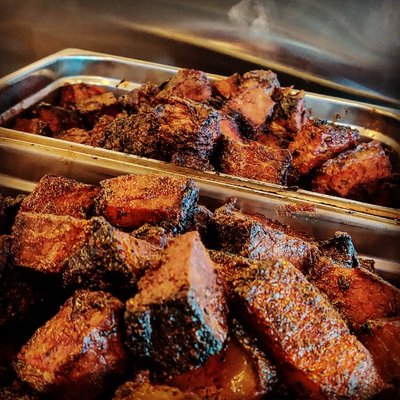
The height and width of the screenshot is (400, 400). I want to click on sauce stain, so [x=125, y=84].